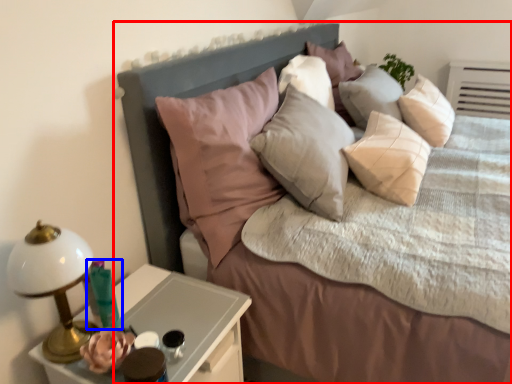
Question: Which of the following is the closest to the observer, bed (highlighted by a red box) or candle holder (highlighted by a blue box)?

Choices:
 (A) bed
 (B) candle holder

Answer: (A)